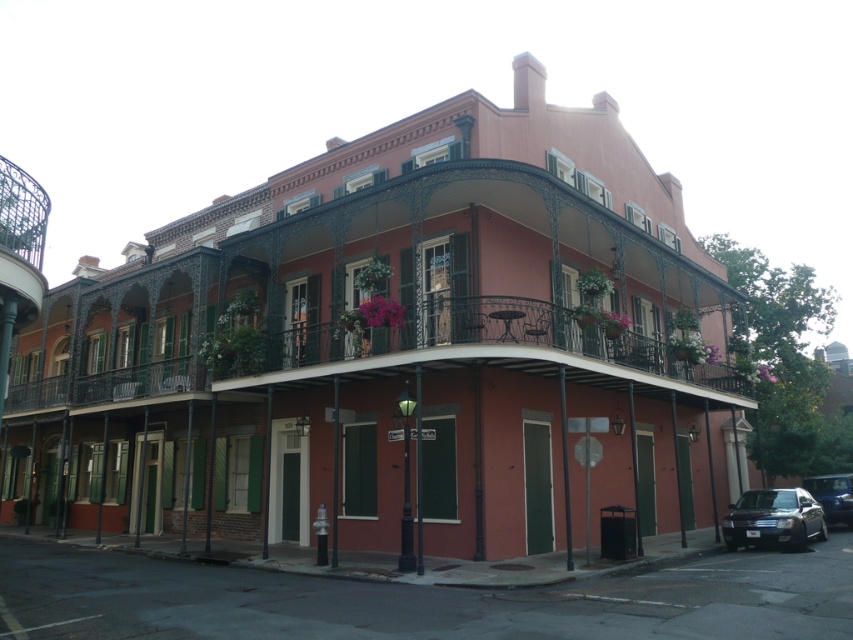
Is shiny black sedan at lower right smaller than shiny blue sedan at lower right?

No.

Does shiny black sedan at lower right appear on the left side of shiny blue sedan at lower right?

Yes, shiny black sedan at lower right is to the left of shiny blue sedan at lower right.

Between point (724, 529) and point (850, 528), which one is positioned behind?

The point (850, 528) is behind.

Locate an element on the screen. shiny black sedan at lower right is located at coordinates (773, 518).